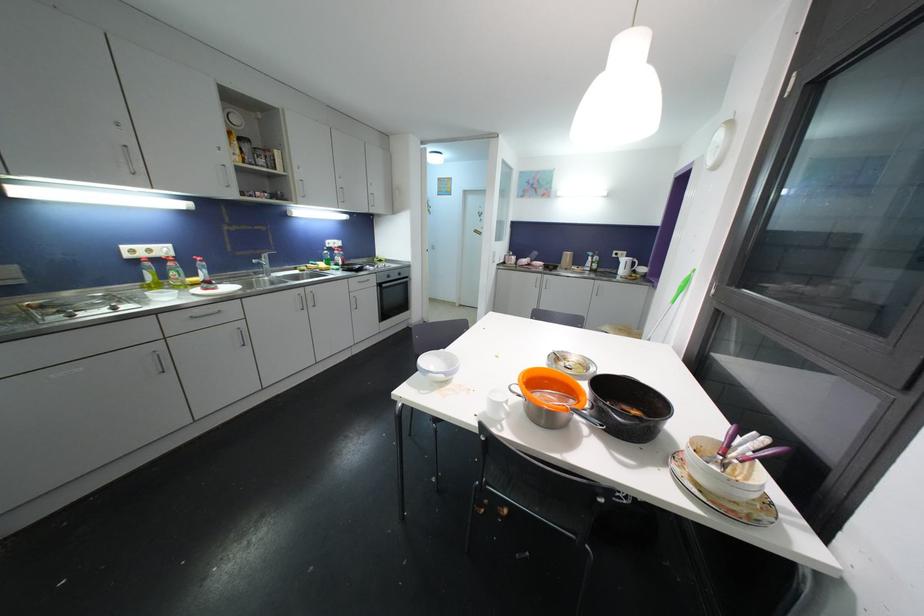
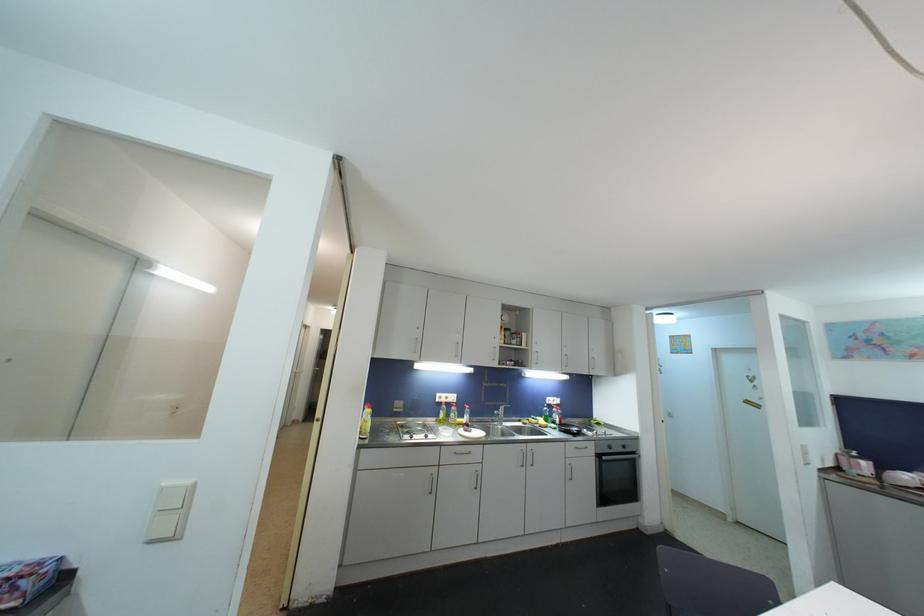
The point at (130, 257) is marked in the first image. Where is the corresponding point in the second image?

(441, 403)